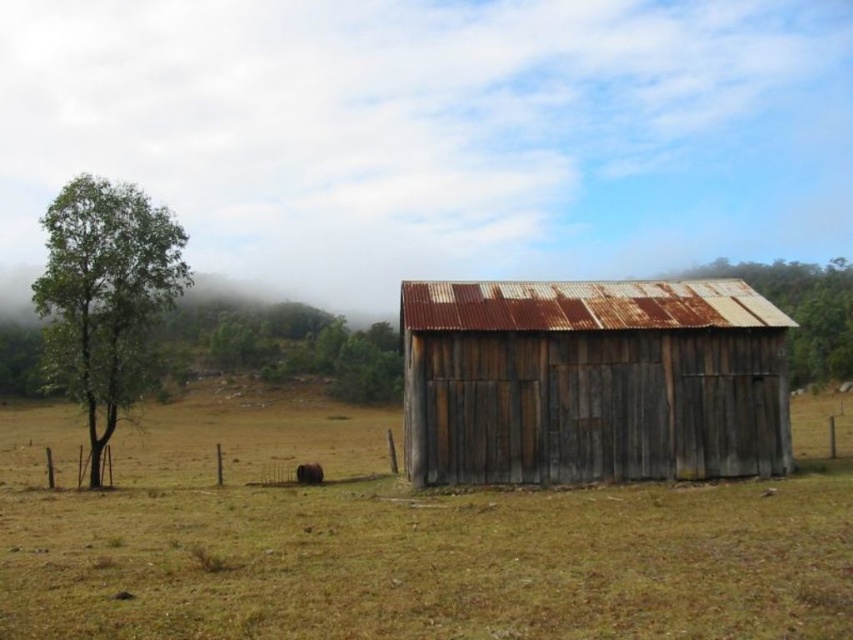
You are standing at the origin point of the image. There is a rusty wood shed at center at point (592, 381). Can you tell me the coordinates of the rusty wood shed at center?

The rusty wood shed at center is located at point (592, 381).